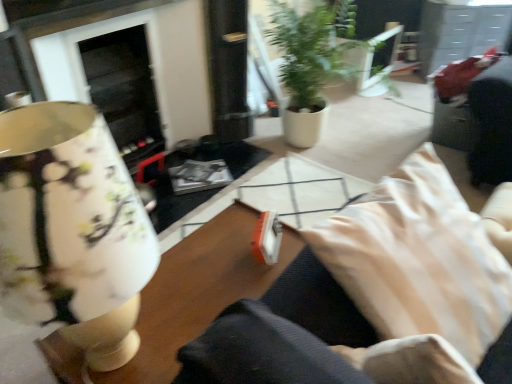
Identify the location of beige fabric pillow at lower right. (419, 259).

The image size is (512, 384). I want to click on wooden table at center, so click(x=198, y=291).

Where is `green matte plant at center`? green matte plant at center is located at coordinates (313, 62).

Can you confirm if wooden table at center is smaller than green matte plant at center?

Yes.

In the scene shown: From the image's perspective, is wooden table at center under green matte plant at center?

Yes.

Considering the relative positions of wooden table at center and green matte plant at center in the image provided, is wooden table at center behind green matte plant at center?

No, wooden table at center is in front of green matte plant at center.

Does wooden table at center have a lesser height compared to green matte plant at center?

Yes, wooden table at center is shorter than green matte plant at center.

Is beige fabric pillow at lower right thinner than green matte plant at center?

Indeed, beige fabric pillow at lower right has a lesser width compared to green matte plant at center.

In the scene shown: Considering their positions, is beige fabric pillow at lower right located in front of or behind green matte plant at center?

Clearly, beige fabric pillow at lower right is in front of green matte plant at center.

From a real-world perspective, relative to green matte plant at center, is beige fabric pillow at lower right vertically above or below?

beige fabric pillow at lower right is situated higher than green matte plant at center in the real world.

Is beige fabric pillow at lower right not close to green matte plant at center?

Absolutely, beige fabric pillow at lower right is distant from green matte plant at center.

Is green matte plant at center far away from wooden table at center?

Yes, green matte plant at center and wooden table at center are located far from each other.

Which of these two, green matte plant at center or wooden table at center, is bigger?

green matte plant at center.

In the scene shown: Considering the positions of objects green matte plant at center and wooden table at center in the image provided, who is more to the right, green matte plant at center or wooden table at center?

Positioned to the right is green matte plant at center.

Looking at this image, considering the relative sizes of green matte plant at center and wooden table at center in the image provided, is green matte plant at center taller than wooden table at center?

Correct, green matte plant at center is much taller as wooden table at center.

Is the depth of green matte plant at center less than that of beige fabric pillow at lower right?

No, it is not.

In terms of size, does green matte plant at center appear bigger or smaller than beige fabric pillow at lower right?

Considering their sizes, green matte plant at center takes up more space than beige fabric pillow at lower right.

Considering the relative positions of green matte plant at center and beige fabric pillow at lower right in the image provided, is green matte plant at center to the left of beige fabric pillow at lower right from the viewer's perspective?

Incorrect, green matte plant at center is not on the left side of beige fabric pillow at lower right.

Between wooden table at center and matte floral lampshade at left, which one appears on the right side from the viewer's perspective?

Positioned to the right is wooden table at center.

From a real-world perspective, is wooden table at center positioned above or below matte floral lampshade at left?

wooden table at center is below matte floral lampshade at left.

Is wooden table at center smaller than matte floral lampshade at left?

No.

Looking at this image, which object is more forward, beige fabric pillow at lower right or wooden table at center?

beige fabric pillow at lower right is closer to the camera.

From the image's perspective, which object appears higher, beige fabric pillow at lower right or wooden table at center?

beige fabric pillow at lower right is shown above in the image.

Locate an element on the screen. This screenshot has width=512, height=384. pillow above the wooden table at center (from the image's perspective) is located at coordinates (419, 259).

From a real-world perspective, is beige fabric pillow at lower right physically above wooden table at center?

Yes, from a real-world perspective, beige fabric pillow at lower right is over wooden table at center

From a real-world perspective, does matte floral lampshade at left sit lower than beige fabric pillow at lower right?

No, from a real-world perspective, matte floral lampshade at left is not beneath beige fabric pillow at lower right.

Which is in front, point (51, 155) or point (479, 226)?

The point (51, 155) is closer to the camera.

From the image's perspective, is matte floral lampshade at left located above beige fabric pillow at lower right?

Correct, matte floral lampshade at left appears higher than beige fabric pillow at lower right in the image.

Between matte floral lampshade at left and beige fabric pillow at lower right, which one has more height?

With more height is matte floral lampshade at left.

The width and height of the screenshot is (512, 384). I want to click on houseplant that appears above the wooden table at center (from the image's perspective), so click(313, 62).

Identify the location of houseplant that is on the right side of beige fabric pillow at lower right. The height and width of the screenshot is (384, 512). (313, 62).

From the image, which object appears to be farther from matte floral lampshade at left, wooden table at center or beige fabric pillow at lower right?

beige fabric pillow at lower right is positioned further to the anchor matte floral lampshade at left.

Considering their positions, is green matte plant at center positioned further to wooden table at center than matte floral lampshade at left?

green matte plant at center lies further to wooden table at center than the other object.

When comparing their distances from beige fabric pillow at lower right, does wooden table at center or green matte plant at center seem closer?

wooden table at center is positioned closer to the anchor beige fabric pillow at lower right.

Based on their spatial positions, is matte floral lampshade at left or green matte plant at center further from beige fabric pillow at lower right?

green matte plant at center is further to beige fabric pillow at lower right.

Estimate the real-world distances between objects in this image. Which object is further from green matte plant at center, matte floral lampshade at left or wooden table at center?

matte floral lampshade at left lies further to green matte plant at center than the other object.

From the image, which object appears to be nearer to wooden table at center, matte floral lampshade at left or green matte plant at center?

matte floral lampshade at left lies closer to wooden table at center than the other object.

Based on their spatial positions, is beige fabric pillow at lower right or green matte plant at center further from matte floral lampshade at left?

Among the two, green matte plant at center is located further to matte floral lampshade at left.

Consider the image. When comparing their distances from matte floral lampshade at left, does green matte plant at center or wooden table at center seem further?

green matte plant at center lies further to matte floral lampshade at left than the other object.

Locate an element on the screen. table between beige fabric pillow at lower right and green matte plant at center from front to back is located at coordinates (198, 291).

Locate an element on the screen. This screenshot has width=512, height=384. pillow between matte floral lampshade at left and green matte plant at center from front to back is located at coordinates (419, 259).

Identify the location of table between matte floral lampshade at left and green matte plant at center along the z-axis. This screenshot has width=512, height=384. [198, 291].

This screenshot has height=384, width=512. I want to click on table situated between matte floral lampshade at left and beige fabric pillow at lower right from left to right, so click(x=198, y=291).